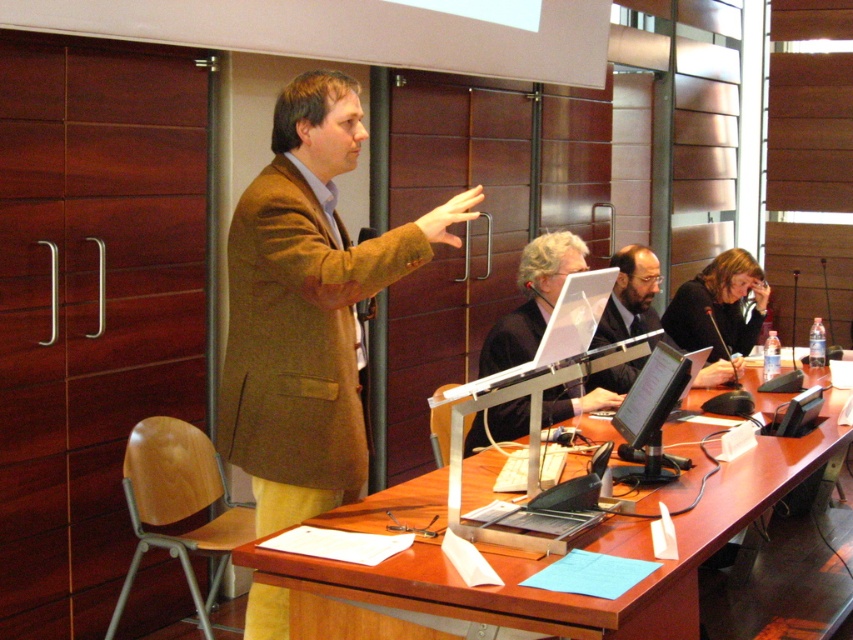
You are attending a presentation in the conference room and notice two items at the center of the room. The items are the matte black laptop at center and the matte black suit at center. Which item is positioned closer to the front of the room?

The matte black laptop at center is closer to the front of the room because the matte black suit at center is behind it.